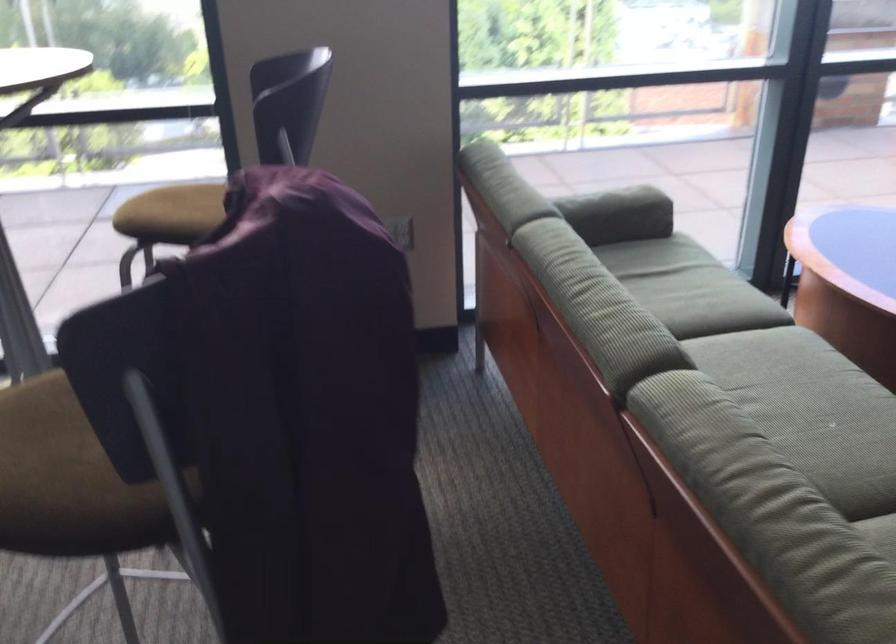
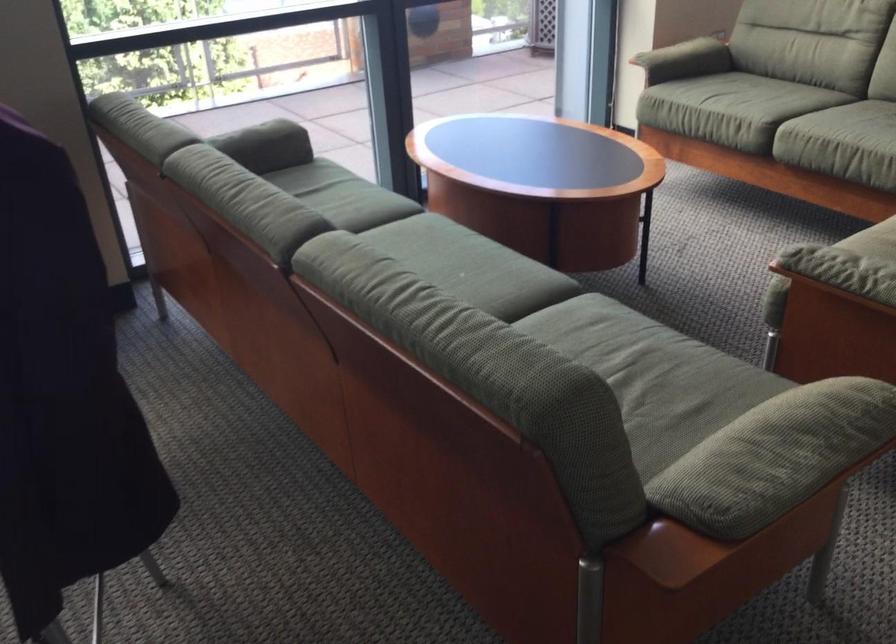
Question: Which direction would the cameraman need to move to produce the second image? Reply with the corresponding letter.

Choices:
 (A) Left
 (B) Right
 (C) Forward
 (D) Backward

Answer: (D)